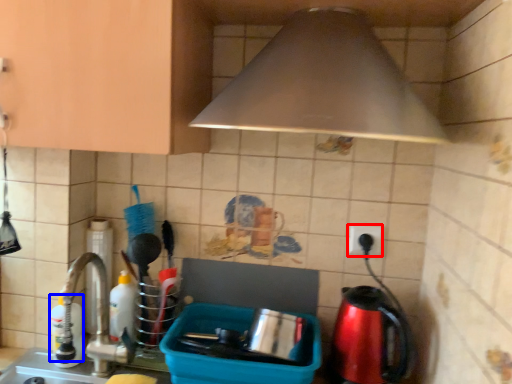
Question: Among these objects, which one is nearest to the camera, electric outlet (highlighted by a red box) or bottle (highlighted by a blue box)?

Choices:
 (A) electric outlet
 (B) bottle

Answer: (B)